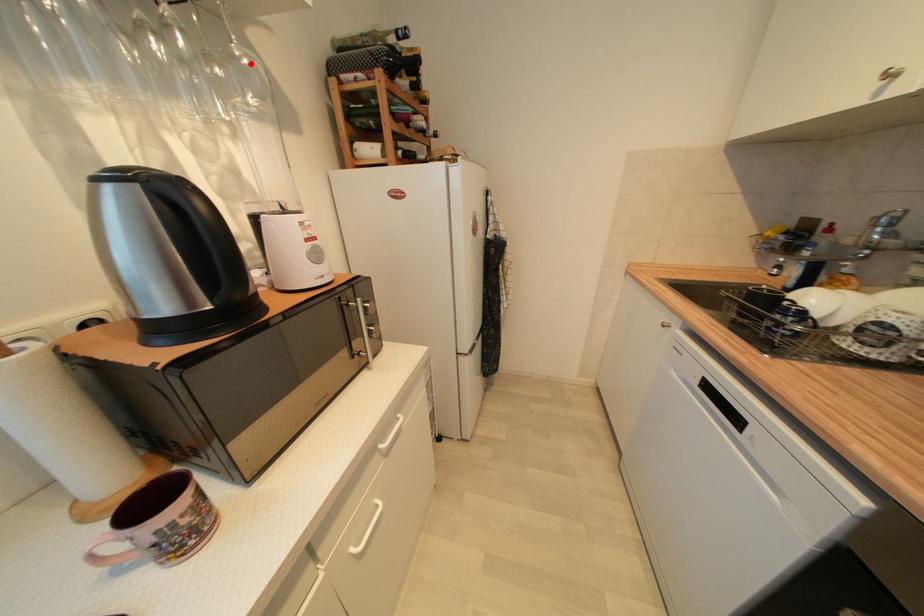
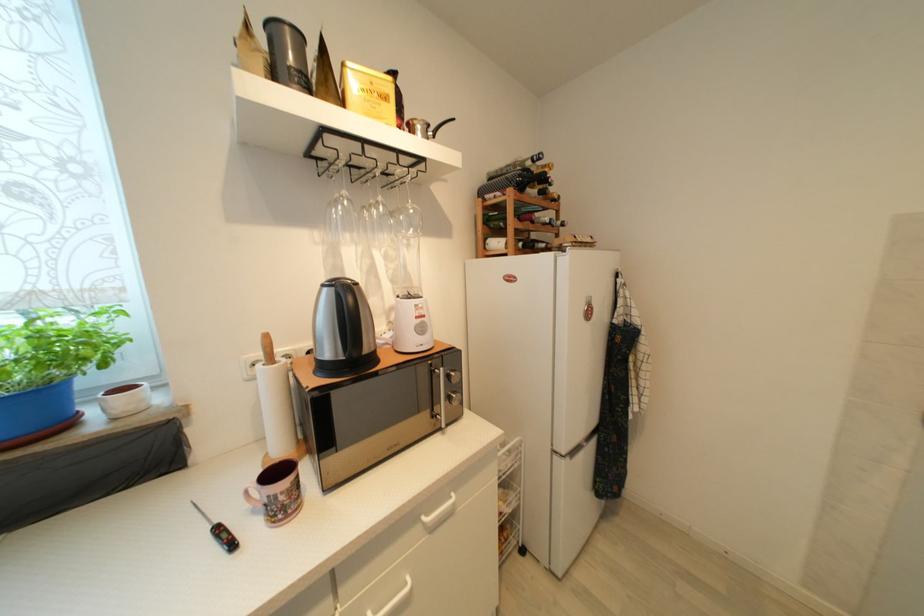
In the second image, find the point that corresponds to the highlighted location in the first image.

(417, 213)